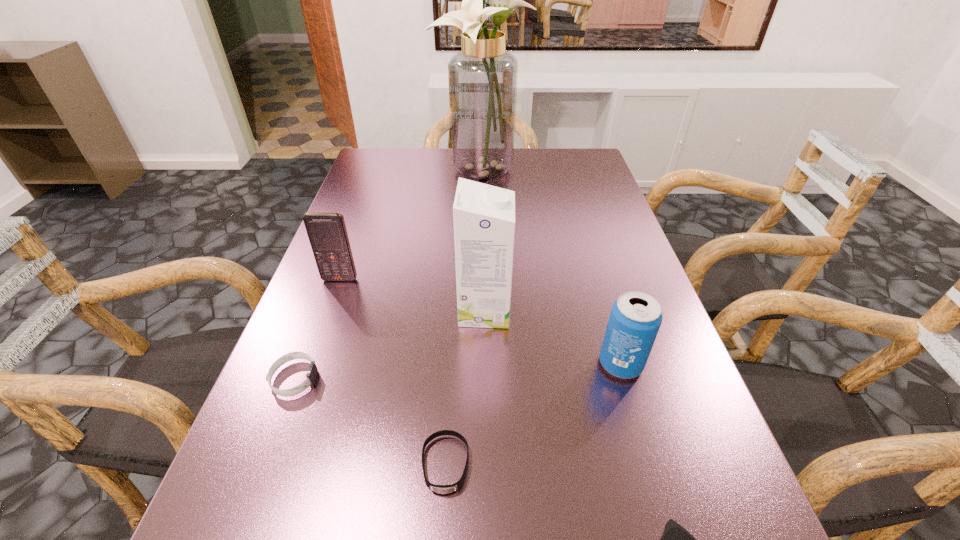
What are the coordinates of `the tallest object` in the screenshot? It's located at (483, 76).

Where is `flower arrangement`? flower arrangement is located at coordinates (483, 76).

The width and height of the screenshot is (960, 540). Identify the location of carton. (484, 216).

Find the location of a particular element. This screenshot has height=540, width=960. the sixth shortest object is located at coordinates (484, 216).

The image size is (960, 540). In order to click on the sixth nearest object in this screenshot , I will do `click(327, 233)`.

Find the location of a particular element. The height and width of the screenshot is (540, 960). soda can is located at coordinates (635, 318).

The height and width of the screenshot is (540, 960). Find the location of `the taller wristband`. the taller wristband is located at coordinates (312, 372).

You are a GUI agent. You are given a task and a screenshot of the screen. Output one action in this format:
    pyautogui.click(x=<x>, y=<y>)
    Task: Click on the farther wristband
    The height and width of the screenshot is (540, 960).
    Given the screenshot: What is the action you would take?
    pyautogui.click(x=312, y=372)

Locate an element on the screen. Image resolution: width=960 pixels, height=540 pixels. the sixth tallest object is located at coordinates (441, 489).

Where is `the sixth farthest object`? The width and height of the screenshot is (960, 540). the sixth farthest object is located at coordinates (441, 489).